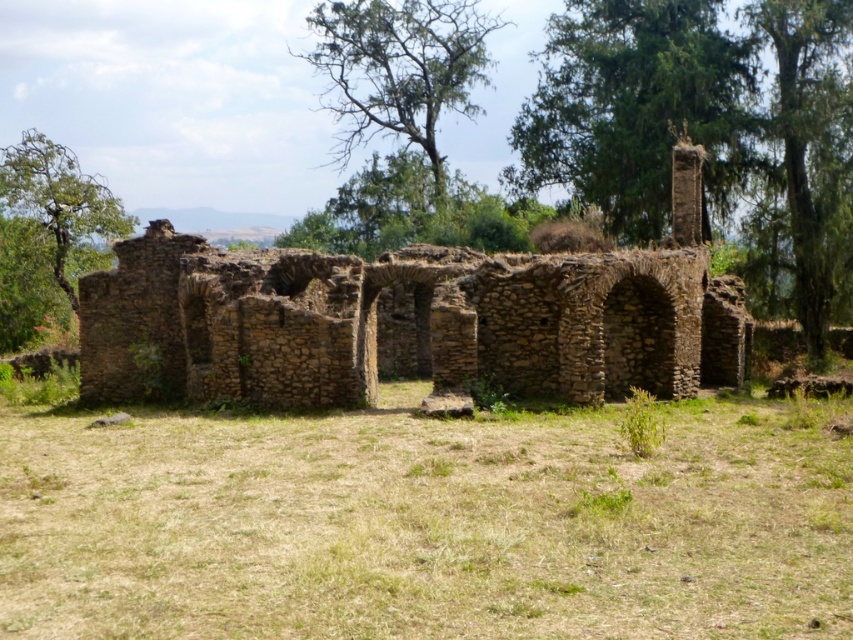
Is brown stone ruins at center thinner than green leafy tree at upper right?

No, brown stone ruins at center is not thinner than green leafy tree at upper right.

Is brown stone ruins at center to the right of green leafy tree at upper right from the viewer's perspective?

No, brown stone ruins at center is not to the right of green leafy tree at upper right.

Between point (230, 317) and point (851, 180), which one is positioned in front?

Point (230, 317) is more forward.

Locate an element on the screen. Image resolution: width=853 pixels, height=640 pixels. brown stone ruins at center is located at coordinates (410, 320).

Between brown dry grass at center and brown stone ruins at center, which one is positioned higher?

brown stone ruins at center

Is brown dry grass at center positioned in front of brown stone ruins at center?

Yes, brown dry grass at center is in front of brown stone ruins at center.

Between point (747, 554) and point (538, 301), which one is positioned behind?

Positioned behind is point (538, 301).

Locate an element on the screen. Image resolution: width=853 pixels, height=640 pixels. brown dry grass at center is located at coordinates (426, 524).

Is brown dry grass at center behind green leafy tree at upper right?

No, it is in front of green leafy tree at upper right.

Between brown dry grass at center and green leafy tree at upper right, which one is positioned lower?

Positioned lower is brown dry grass at center.

The image size is (853, 640). I want to click on brown dry grass at center, so click(426, 524).

The height and width of the screenshot is (640, 853). I want to click on brown dry grass at center, so click(x=426, y=524).